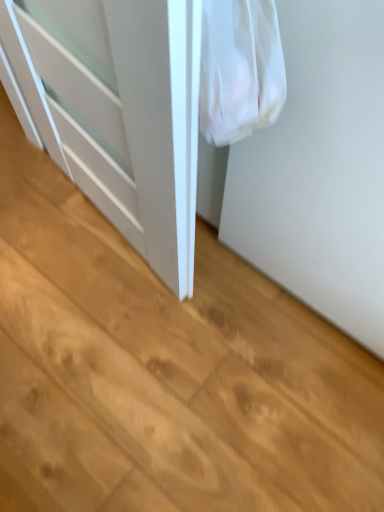
Describe the element at coordinates (239, 69) in the screenshot. I see `white fabric bag at upper right` at that location.

I want to click on white fabric bag at upper right, so click(x=239, y=69).

Where is `white fabric bag at upper right`? The height and width of the screenshot is (512, 384). white fabric bag at upper right is located at coordinates (239, 69).